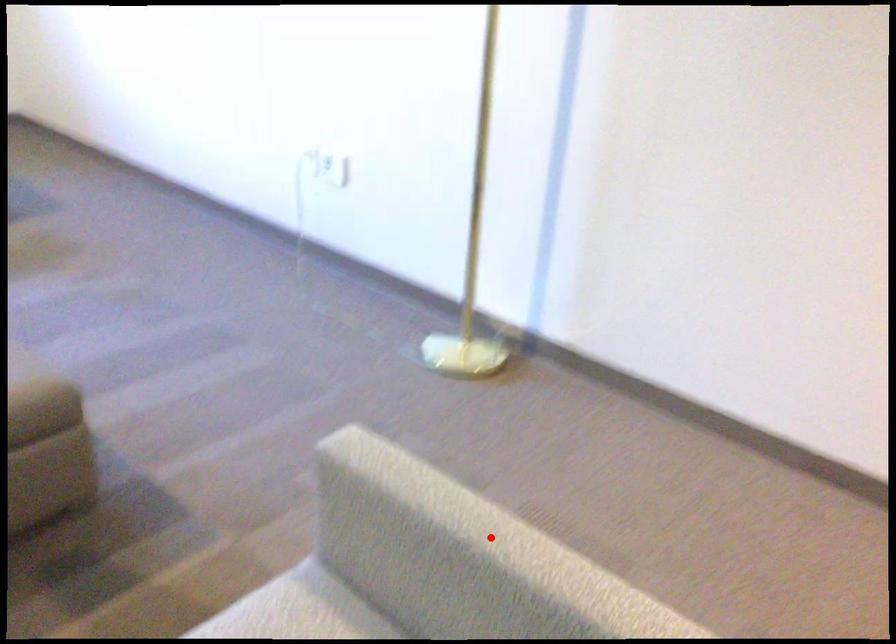
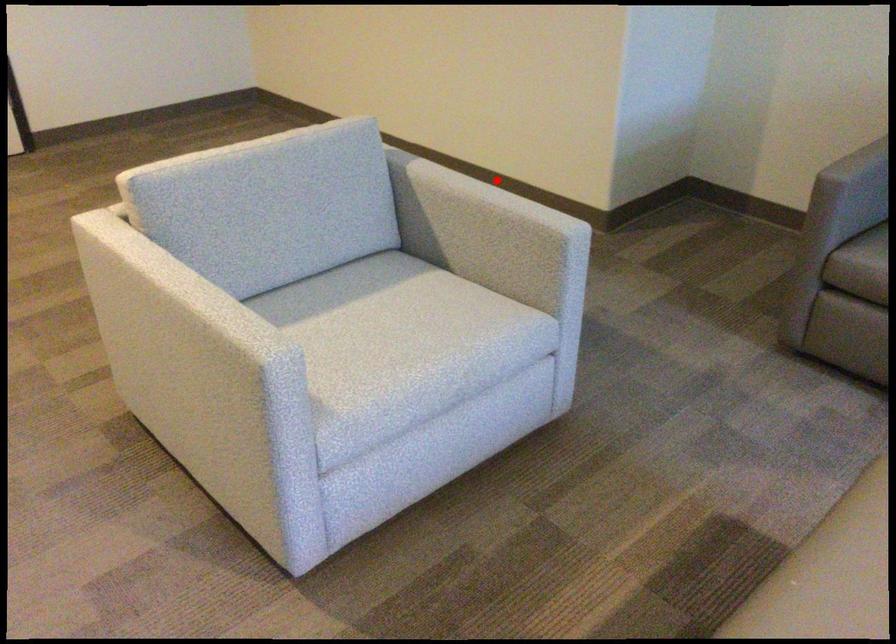
I am providing you with two images of the same scene from different viewpoints. A red point is marked on the first image and another point is marked on the second image. Is the red point in image1 aligned with the point shown in image2?

No